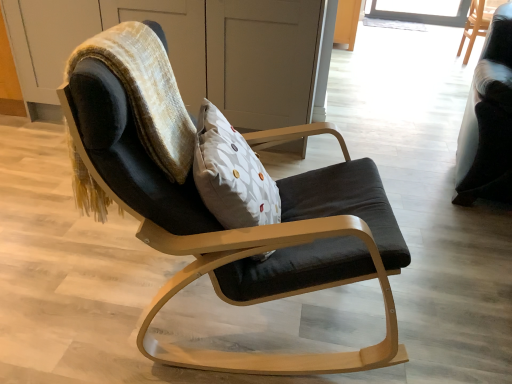
Question: Would you say matte wood dresser at center is to the left or to the right of black fabric chair at upper right, positioned as the 3th chair in front-to-back order, in the picture?

Choices:
 (A) left
 (B) right

Answer: (A)

Question: From the image's perspective, is matte wood dresser at center located above or below black fabric chair at upper right, positioned as the third chair in left-to-right order?

Choices:
 (A) below
 (B) above

Answer: (A)

Question: Which object is the closest to the white dotted pillow at center?

Choices:
 (A) matte wood dresser at center
 (B) velvet black armchair at right, marked as the second chair in a left-to-right arrangement
 (C) velvet black bean bag chair at upper left
 (D) black fabric chair at upper right, positioned as the third chair in left-to-right order
 (E) velvet black chair at center, marked as the first chair in a left-to-right arrangement

Answer: (E)

Question: Estimate the real-world distances between objects in this image. Which object is closer to the velvet black armchair at right, the second chair in the back-to-front sequence?

Choices:
 (A) black fabric chair at upper right, positioned as the 3th chair in front-to-back order
 (B) white dotted pillow at center
 (C) velvet black bean bag chair at upper left
 (D) velvet black chair at center, marked as the third chair in a back-to-front arrangement
 (E) matte wood dresser at center

Answer: (D)